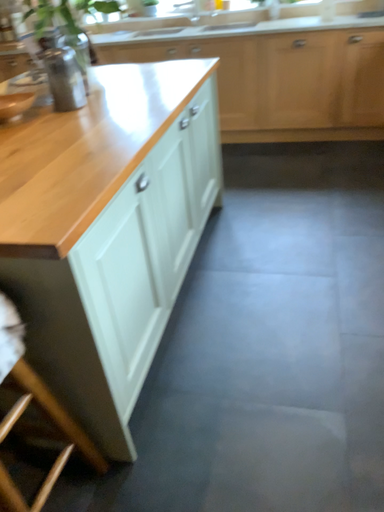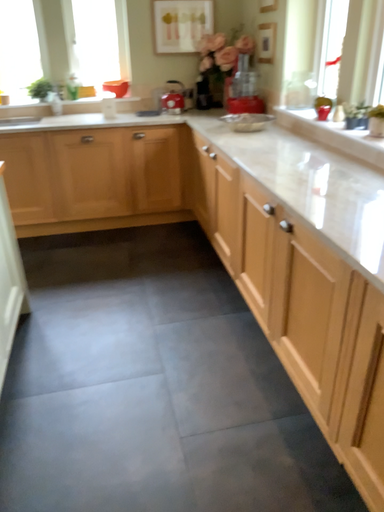
Question: How did the camera likely rotate when shooting the video?

Choices:
 (A) rotated right
 (B) rotated left

Answer: (A)